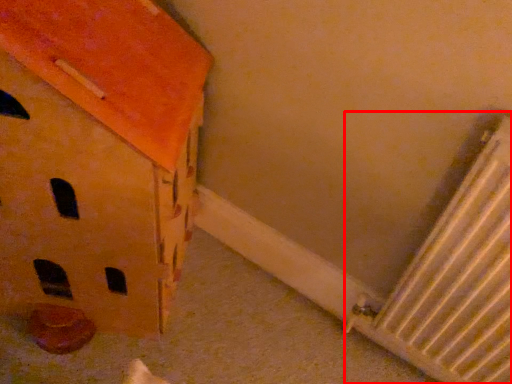
Question: From the image's perspective, what is the correct spatial relationship of radiator (annotated by the red box) in relation to cardboard box?

Choices:
 (A) below
 (B) above

Answer: (A)